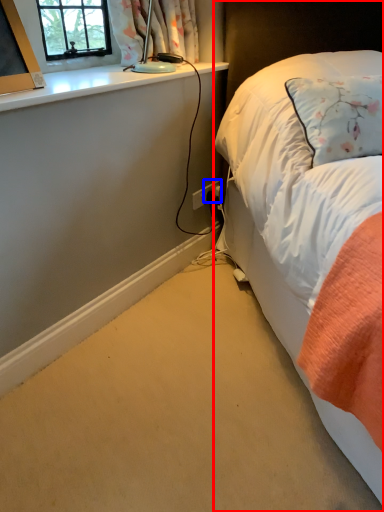
Question: Which object appears closest to the camera in this image, bed (highlighted by a red box) or power plugs and sockets (highlighted by a blue box)?

Choices:
 (A) bed
 (B) power plugs and sockets

Answer: (A)